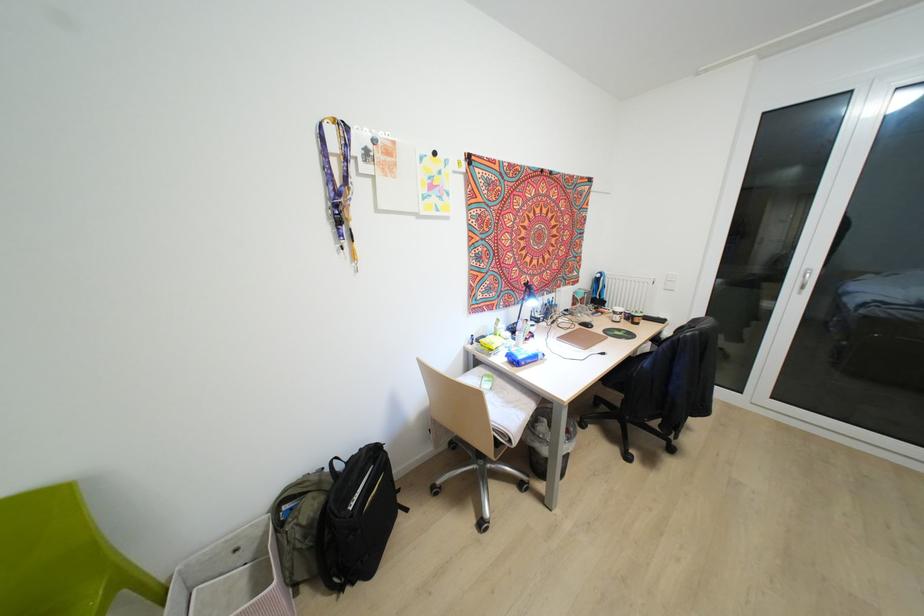
The width and height of the screenshot is (924, 616). Find the location of `black chair sitting surface`. black chair sitting surface is located at coordinates (625, 370).